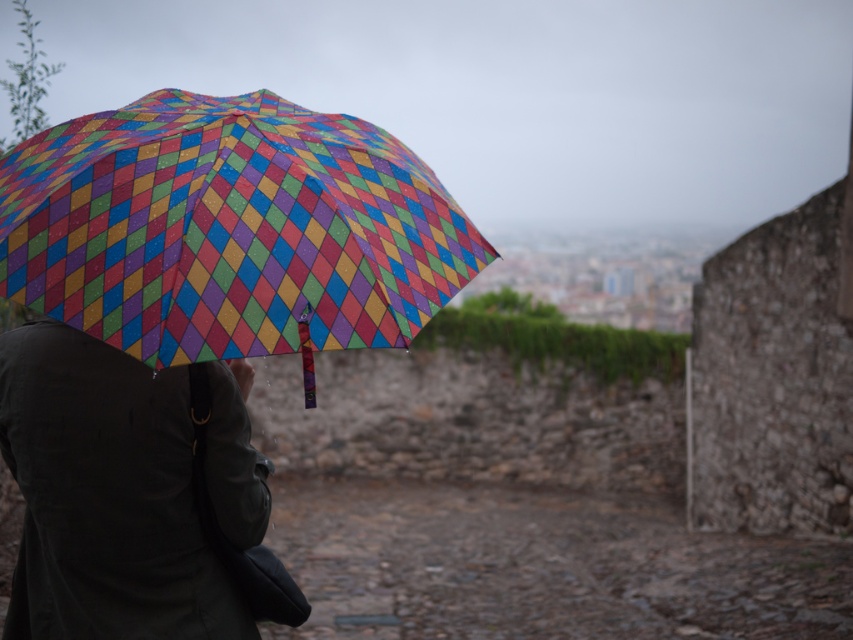
Question: In this image, where is multicolored diamond-patterned umbrella at left located relative to matte black coat at center?

Choices:
 (A) above
 (B) below

Answer: (A)

Question: Is multicolored diamond-patterned umbrella at left bigger than matte black coat at center?

Choices:
 (A) no
 (B) yes

Answer: (B)

Question: Which point is farther to the camera?

Choices:
 (A) multicolored diamond-patterned umbrella at left
 (B) matte black coat at center

Answer: (B)

Question: Which point is closer to the camera?

Choices:
 (A) (288, 145)
 (B) (68, 337)

Answer: (A)

Question: Is multicolored diamond-patterned umbrella at left bigger than matte black coat at center?

Choices:
 (A) yes
 (B) no

Answer: (A)

Question: Which point is closer to the camera taking this photo?

Choices:
 (A) (26, 516)
 (B) (299, 131)

Answer: (B)